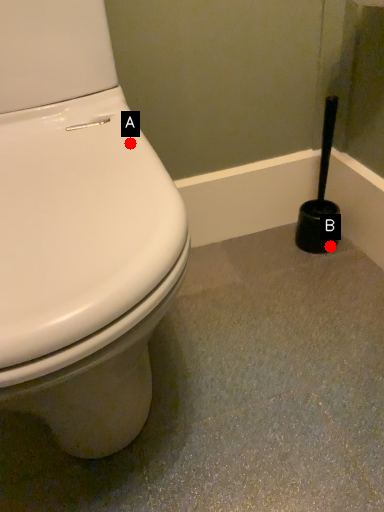
Question: Two points are circled on the image, labeled by A and B beside each circle. Among these points, which one is farthest from the camera?

Choices:
 (A) A is further
 (B) B is further

Answer: (B)